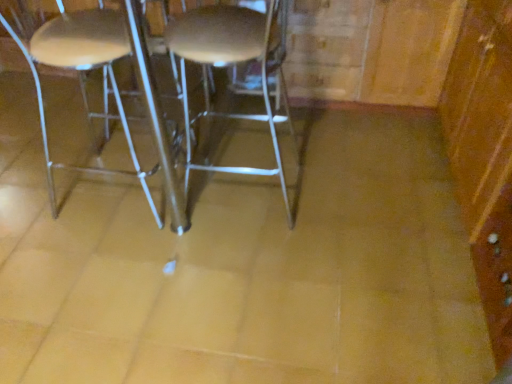
Where is `vacant area that is situated to the right of metallic silver stool at center`? vacant area that is situated to the right of metallic silver stool at center is located at coordinates (350, 190).